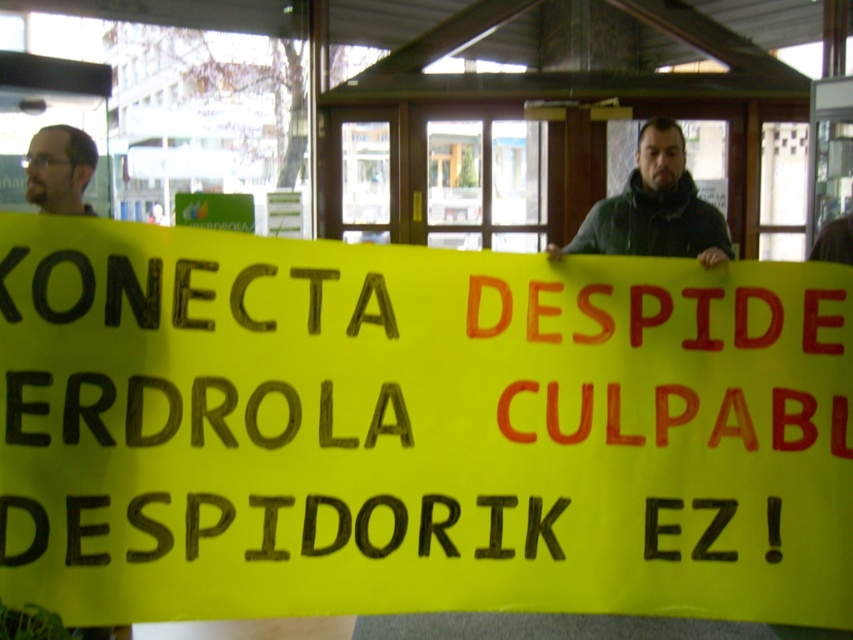
You are a photographer trying to capture a clear shot of the banner text. You notice two people in the scene, one wearing a dark green jacket at center and another with dark brown hair at upper left. Which person is closer to the camera, based on their size in the image?

The dark green jacket at center is larger in size compared to the dark brown hair at upper left, so the person wearing the dark green jacket at center is closer to the camera.

You are a delivery person who needs to deliver a package to the person with dark brown hair at upper left. The delivery requires that the package must be placed exactly 4 feet away from them. Can you place the package at the location of the yellow paper sign at center?

The distance between the yellow paper sign at center and dark brown hair at upper left is 3.84 feet. Since the required distance is 4 feet, the package placed at the yellow paper sign at center would be slightly closer than needed. Therefore, it does not meet the requirement.